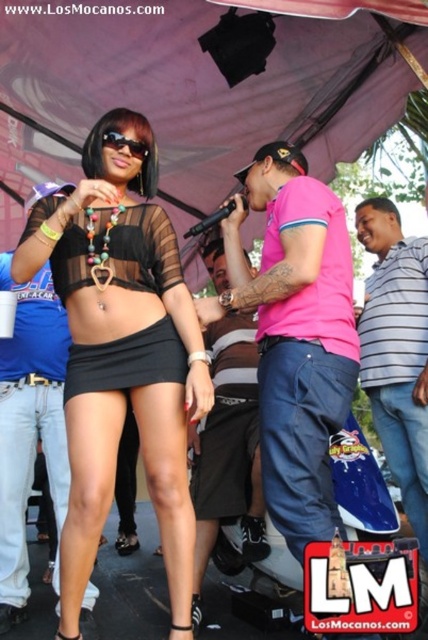
Which is more to the right, black sheer top at center or black matte skirt at center?

Positioned to the right is black matte skirt at center.

Which is behind, point (83, 417) or point (121, 337)?

Positioned behind is point (121, 337).

In the scene shown: Who is more forward, (148, 168) or (139, 337)?

Point (139, 337)

I want to click on black sheer top at center, so click(121, 352).

Does black sheer top at center have a smaller size compared to black mesh skirt at center?

No.

The width and height of the screenshot is (428, 640). I want to click on black sheer top at center, so click(121, 352).

Is pink fabric shirt at center further to the viewer compared to black matte skirt at center?

No, it is in front of black matte skirt at center.

Which is behind, point (318, 499) or point (86, 380)?

The point (86, 380) is behind.

Measure the distance between pink fabric shirt at center and camera.

pink fabric shirt at center and camera are 3.49 meters apart.

The height and width of the screenshot is (640, 428). I want to click on pink fabric shirt at center, so click(297, 333).